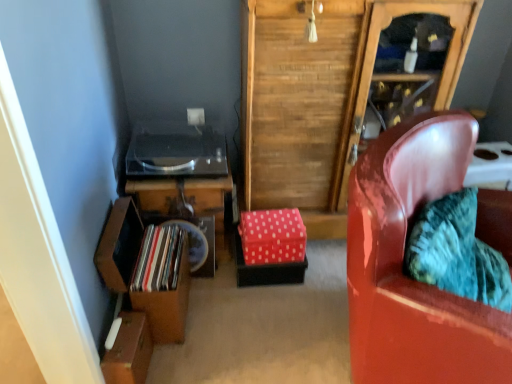
This screenshot has width=512, height=384. Identify the location of shiny metallic record at left. (158, 259).

In order to face wooden record player at lower left, should I rotate leftwards or rightwards?

You should look left and rotate roughly 9.676 degrees.

Where is `brown cardboard box at lower left, the 2th box when ordered from right to left`? The height and width of the screenshot is (384, 512). brown cardboard box at lower left, the 2th box when ordered from right to left is located at coordinates (129, 351).

Is shiny metallic record at left facing towards glossy leather chair at right?

Yes, shiny metallic record at left is turned towards glossy leather chair at right.

From the picture: From the image's perspective, who appears lower, shiny metallic record at left or glossy leather chair at right?

From the image's view, glossy leather chair at right is below.

How many degrees apart are the facing directions of shiny metallic record at left and glossy leather chair at right?

39.6 degrees separate the facing orientations of shiny metallic record at left and glossy leather chair at right.

Consider the image. Is shiny metallic record at left further to the viewer compared to glossy leather chair at right?

Yes, the depth of shiny metallic record at left is greater than that of glossy leather chair at right.

From a real-world perspective, does brown cardboard box at lower left, which is the first box in front-to-back order, stand above wooden shelf at lower left?

Incorrect, from a real-world perspective, brown cardboard box at lower left, which is the first box in front-to-back order, is lower than wooden shelf at lower left.

Find the location of `box directly beneath the wooden shelf at lower left (from a real-world perspective)`. box directly beneath the wooden shelf at lower left (from a real-world perspective) is located at coordinates (129, 351).

Is brown cardboard box at lower left, which is the second box in back-to-front order, inside the boundaries of wooden shelf at lower left, or outside?

brown cardboard box at lower left, which is the second box in back-to-front order, is not inside wooden shelf at lower left, it's outside.

Can you confirm if brown cardboard box at lower left, which is the first box in front-to-back order, is taller than wooden shelf at lower left?

In fact, brown cardboard box at lower left, which is the first box in front-to-back order, may be shorter than wooden shelf at lower left.

Which of these two, red polka dot fabric box at center, marked as the first box in a back-to-front arrangement, or glossy leather chair at right, stands taller?

With more height is glossy leather chair at right.

Is point (285, 260) less distant than point (437, 116)?

No, (285, 260) is behind (437, 116).

Can you confirm if red polka dot fabric box at center, placed as the second box when sorted from bottom to top, is thinner than glossy leather chair at right?

Correct, the width of red polka dot fabric box at center, placed as the second box when sorted from bottom to top, is less than that of glossy leather chair at right.

From a real-world perspective, relative to glossy leather chair at right, is wooden record player at lower left vertically above or below?

From a real-world perspective, wooden record player at lower left is physically below glossy leather chair at right.

Is wooden record player at lower left situated inside glossy leather chair at right or outside?

wooden record player at lower left is outside glossy leather chair at right.

Is wooden record player at lower left aimed at glossy leather chair at right?

No, wooden record player at lower left is not facing towards glossy leather chair at right.

Considering the relative sizes of wooden record player at lower left and glossy leather chair at right in the image provided, is wooden record player at lower left thinner than glossy leather chair at right?

Yes.

Considering the positions of objects red polka dot fabric box at center, the second box in the left-to-right sequence, and wooden shelf at lower left in the image provided, who is more to the right, red polka dot fabric box at center, the second box in the left-to-right sequence, or wooden shelf at lower left?

red polka dot fabric box at center, the second box in the left-to-right sequence, is more to the right.

Considering the sizes of red polka dot fabric box at center, placed as the second box when sorted from bottom to top, and wooden shelf at lower left in the image, is red polka dot fabric box at center, placed as the second box when sorted from bottom to top, bigger or smaller than wooden shelf at lower left?

In the image, red polka dot fabric box at center, placed as the second box when sorted from bottom to top, appears to be smaller than wooden shelf at lower left.

Does red polka dot fabric box at center, which ranks as the first box in top-to-bottom order, have a lesser height compared to wooden shelf at lower left?

Indeed, red polka dot fabric box at center, which ranks as the first box in top-to-bottom order, has a lesser height compared to wooden shelf at lower left.

Consider the image. Who is bigger, wooden record player at lower left or brown cardboard box at lower left, the 2th box when ordered from right to left?

With larger size is wooden record player at lower left.

Is wooden record player at lower left positioned behind brown cardboard box at lower left, marked as the 1th box in a left-to-right arrangement?

Yes, it is.

Is wooden record player at lower left facing away from brown cardboard box at lower left, which is the second box in back-to-front order?

No, brown cardboard box at lower left, which is the second box in back-to-front order, is not at the back of wooden record player at lower left.

Can you confirm if wooden record player at lower left is shorter than brown cardboard box at lower left, positioned as the 2th box in top-to-bottom order?

In fact, wooden record player at lower left may be taller than brown cardboard box at lower left, positioned as the 2th box in top-to-bottom order.

Is wooden record player at lower left at the left side of wooden shelf at lower left?

No, wooden record player at lower left is not to the left of wooden shelf at lower left.

Is wooden record player at lower left not close to wooden shelf at lower left?

That's not correct — wooden record player at lower left is a little close to wooden shelf at lower left.

Is wooden record player at lower left not within wooden shelf at lower left?

Indeed, wooden record player at lower left is completely outside wooden shelf at lower left.

The width and height of the screenshot is (512, 384). Identify the location of chair located on the right of shiny metallic record at left. (402, 265).

Locate an element on the screen. shelf behind the brown cardboard box at lower left, the 2th box when ordered from right to left is located at coordinates (119, 245).

Which object lies nearer to the anchor point glossy leather chair at right, red polka dot fabric box at center, marked as the first box in a back-to-front arrangement, or wooden shelf at lower left?

Among the two, red polka dot fabric box at center, marked as the first box in a back-to-front arrangement, is located nearer to glossy leather chair at right.

Based on their spatial positions, is wooden shelf at lower left or red polka dot fabric box at center, which ranks as the first box in top-to-bottom order, closer to shiny metallic record at left?

Based on the image, wooden shelf at lower left appears to be nearer to shiny metallic record at left.

Based on their spatial positions, is wooden shelf at lower left or red polka dot fabric box at center, the second box in the left-to-right sequence, closer to glossy leather chair at right?

red polka dot fabric box at center, the second box in the left-to-right sequence.

Looking at the image, which one is located further to wooden record player at lower left, red polka dot fabric box at center, the second box viewed from the front, or brown cardboard box at lower left, which is the first box in front-to-back order?

brown cardboard box at lower left, which is the first box in front-to-back order, is positioned further to the anchor wooden record player at lower left.

Based on their spatial positions, is wooden record player at lower left or red polka dot fabric box at center, the second box viewed from the front, further from brown cardboard box at lower left, the 2th box when ordered from right to left?

Based on the image, red polka dot fabric box at center, the second box viewed from the front, appears to be further to brown cardboard box at lower left, the 2th box when ordered from right to left.

Estimate the real-world distances between objects in this image. Which object is further from wooden shelf at lower left, glossy leather chair at right or brown cardboard box at lower left, which is the first box in front-to-back order?

Based on the image, glossy leather chair at right appears to be further to wooden shelf at lower left.

Considering their positions, is wooden record player at lower left positioned closer to wooden shelf at lower left than glossy leather chair at right?

wooden record player at lower left lies closer to wooden shelf at lower left than the other object.

Based on their spatial positions, is wooden record player at lower left or wooden shelf at lower left closer to brown cardboard box at lower left, marked as the first box in a bottom-to-top arrangement?

Based on the image, wooden shelf at lower left appears to be nearer to brown cardboard box at lower left, marked as the first box in a bottom-to-top arrangement.

Find the location of a particular element. The width and height of the screenshot is (512, 384). table between brown cardboard box at lower left, which is the first box in front-to-back order, and wooden cabinet at center, in the horizontal direction is located at coordinates (186, 201).

Locate an element on the screen. The image size is (512, 384). cabinetry between brown cardboard box at lower left, marked as the 1th box in a left-to-right arrangement, and glossy leather chair at right from left to right is located at coordinates (321, 97).

This screenshot has width=512, height=384. I want to click on shelf between shiny metallic record at left and brown cardboard box at lower left, marked as the 1th box in a left-to-right arrangement, in the up-down direction, so click(x=119, y=245).

The image size is (512, 384). I want to click on box between shiny metallic record at left and wooden cabinet at center, so click(272, 236).